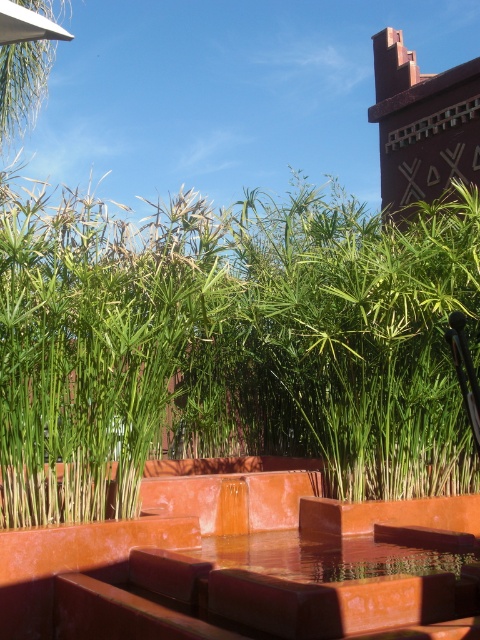
Question: Considering the relative positions of green leafy plant at center and transparent glass water at center in the image provided, where is green leafy plant at center located with respect to transparent glass water at center?

Choices:
 (A) above
 (B) below

Answer: (A)

Question: Can you confirm if green leafy plant at center is positioned to the right of transparent glass water at center?

Choices:
 (A) no
 (B) yes

Answer: (A)

Question: From the image, what is the correct spatial relationship of green leafy plant at center in relation to transparent glass water at center?

Choices:
 (A) left
 (B) right

Answer: (A)

Question: Which point is closer to the camera taking this photo?

Choices:
 (A) (476, 557)
 (B) (268, 204)

Answer: (A)